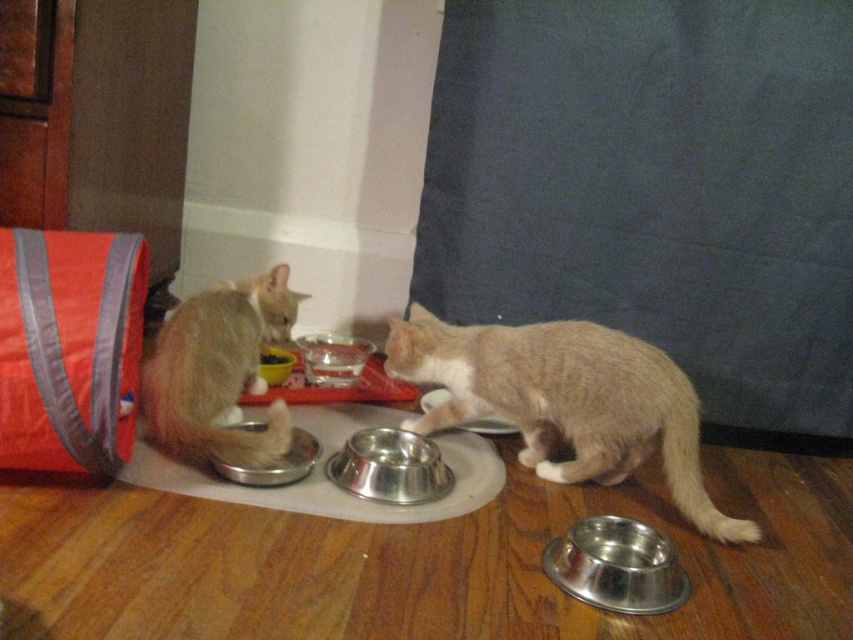
You are a cat owner who wants to ensure both cats have enough space to eat comfortably. Given that the light brown fur at left is wider than the shiny metallic bowl at center, can the cat fit next to the bowl without feeling cramped?

The light brown fur at left is wider than the shiny metallic bowl at center, so the cat may need more space to eat comfortably next to the bowl to avoid feeling cramped.

You are a cat owner who wants to clean the shiny metallic bowl at lower right. You are currently standing 35.69 inches away from it. Can you reach the bowl without moving your feet?

The shiny metallic bowl at lower right is 35.69 inches away from the viewer. Since the average human arm length is about 25 to 30 inches, you cannot reach it without moving closer.

You are a cat owner who wants to ensure your cats have enough space to eat comfortably. Based on the image, which bowl is positioned to the right of the other between the shiny metallic bowl at lower right and the metallic silver bowl at center?

The shiny metallic bowl at lower right is positioned to the right of the metallic silver bowl at center.